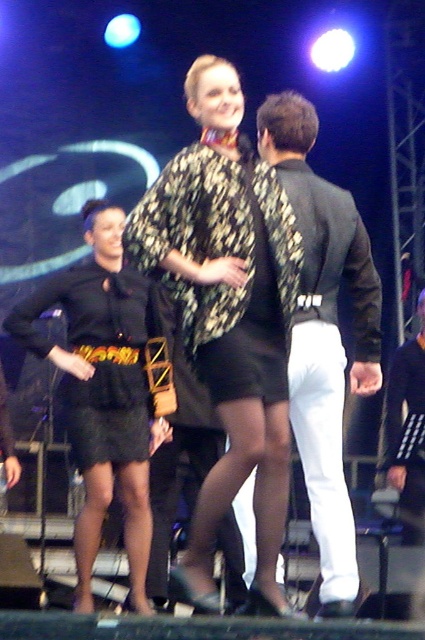
You are a stagehand responsible for setting up a narrow walkway that must fit either the printed fabric cape at center or the shiny black jacket at center. Based on their widths, which one can definitely pass through the walkway without needing adjustments?

The printed fabric cape at center might be wider than shiny black jacket at center, so the shiny black jacket at center can definitely pass through the walkway without needing adjustments since it is narrower.

You are standing in the audience and want to see the performer at point (221, 129) clearly. The theater has a rule that you must be at least 3 meters away from any performer to avoid disrupting the show. Is your current position compliant with this rule?

The point (221, 129) is 3.42 meters from the viewer, which is more than the required 3 meters, so your position is compliant with the theater rule.

You are a costume designer observing the stage setup. You need to determine which of the two center items, the printed fabric cape at center or the shiny black jacket at center, would cast a larger shadow on the stage floor. Based on their positions, which one do you think will have a bigger shadow?

The printed fabric cape at center is taller than the shiny black jacket at center, so it will cast a larger shadow on the stage floor.